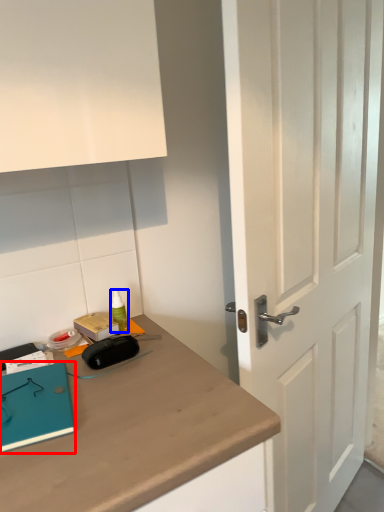
Question: Which object is closer to the camera taking this photo, notebook (highlighted by a red box) or stationery (highlighted by a blue box)?

Choices:
 (A) notebook
 (B) stationery

Answer: (A)